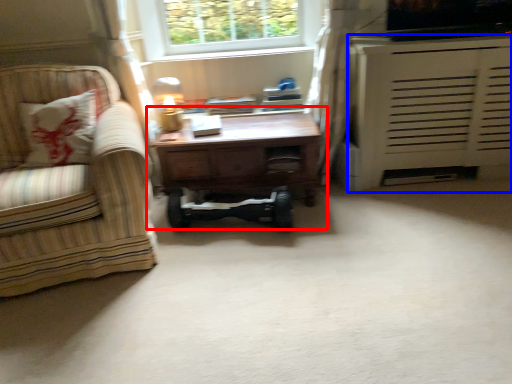
Question: Which object appears farthest to the camera in this image, table (highlighted by a red box) or cabinetry (highlighted by a blue box)?

Choices:
 (A) table
 (B) cabinetry

Answer: (A)